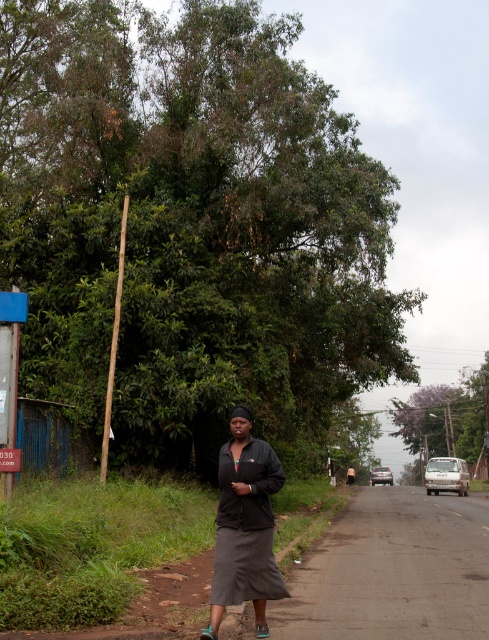
You are a fashion designer observing a woman wearing a dark gray fabric dress at center and a brown fabric shirt at center. How far apart are the two clothing items on her body?

The dark gray fabric dress at center is 44.93 meters from brown fabric shirt at center.